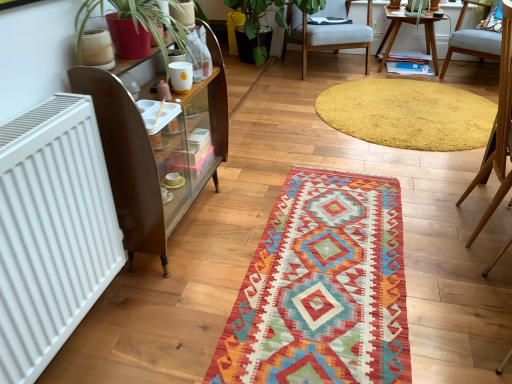
Identify the location of free point below light blue fabric chair at right, which is the 1th chair from front to back (from a real-world perspective). The width and height of the screenshot is (512, 384). (480, 220).